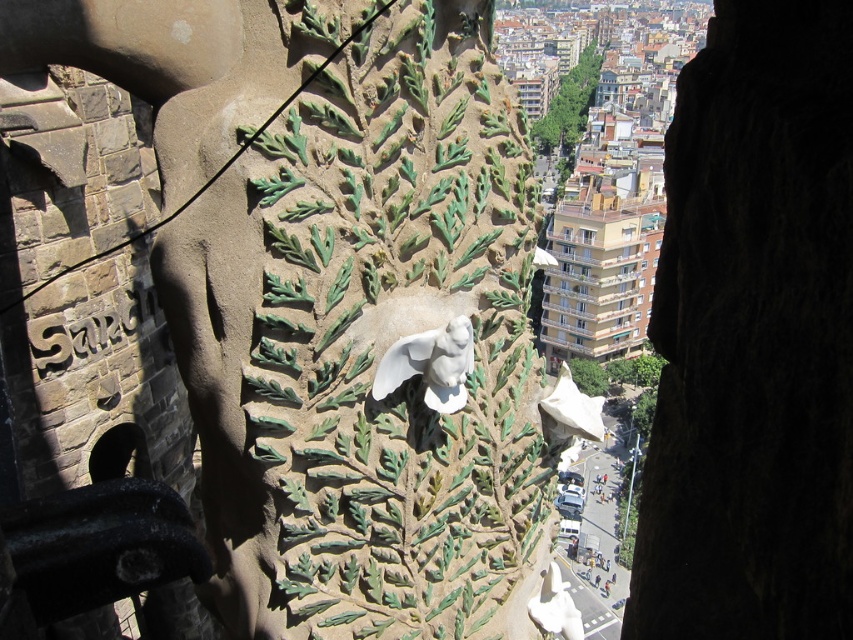
Which is above, white stone bird at center or white glossy statue at center?

white stone bird at center

Which is behind, point (177, 115) or point (404, 346)?

The point (177, 115) is more distant.

I want to click on white stone bird at center, so click(x=339, y=300).